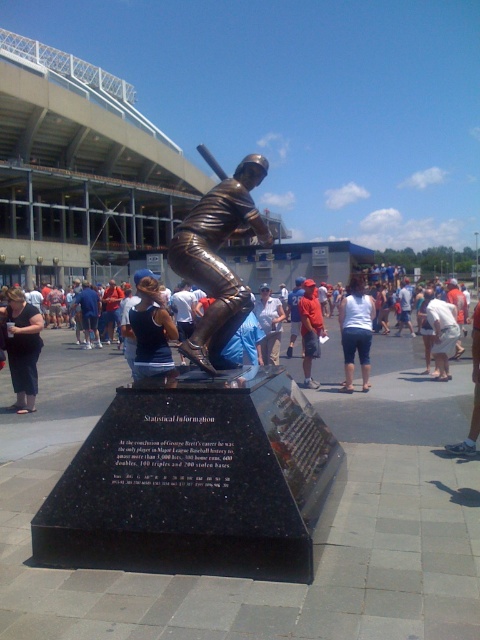
Consider the image. Can you confirm if dark blue tank top at center is wider than denim shorts at center?

No.

Can you confirm if dark blue tank top at center is smaller than denim shorts at center?

Indeed, dark blue tank top at center has a smaller size compared to denim shorts at center.

From the picture: Who is more forward, (142, 374) or (85, 348)?

Point (142, 374) is in front.

Where is `dark blue tank top at center`? The width and height of the screenshot is (480, 640). dark blue tank top at center is located at coordinates (149, 330).

Is point (344, 385) positioned behind point (80, 296)?

No.

Between white cotton tank top at center and denim shorts at center, which one appears on the left side from the viewer's perspective?

denim shorts at center

Between point (344, 326) and point (88, 330), which one is positioned behind?

The point (88, 330) is more distant.

Locate an element on the screen. This screenshot has height=640, width=480. white cotton tank top at center is located at coordinates (356, 330).

Is point (16, 374) closer to viewer compared to point (84, 321)?

Yes, it is.

Is point (35, 364) closer to viewer compared to point (90, 321)?

Yes, point (35, 364) is in front of point (90, 321).

The image size is (480, 640). Find the location of `dark gray pants at lower left`. dark gray pants at lower left is located at coordinates (23, 348).